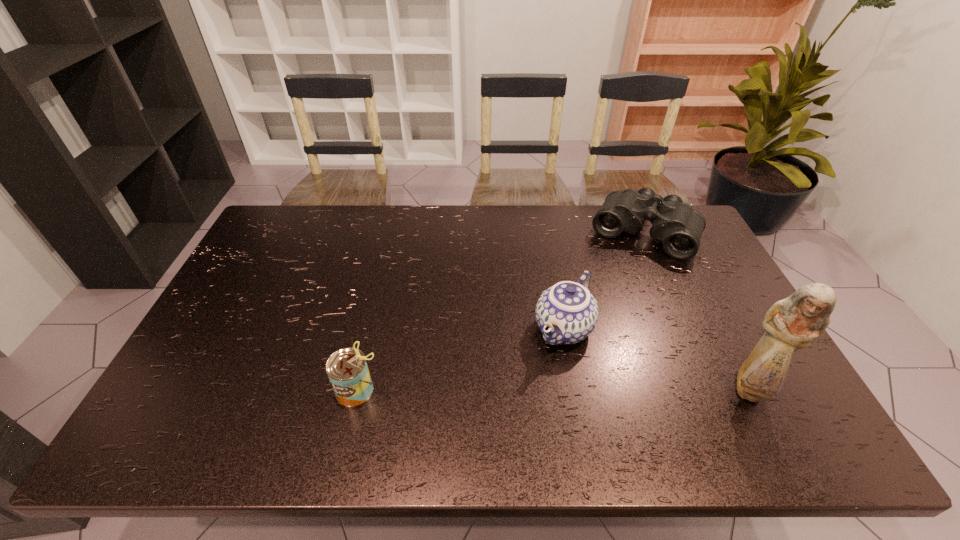
Locate an element on the screen. This screenshot has height=540, width=960. free space on the desktop that is between the leftmost object and the figurine and is positioned at the eyepieces of the binoculars is located at coordinates (571, 389).

Identify the location of free space on the desktop that is between the leftmost object and the tallest object and is positioned from the spout of the third nearest object. (517, 389).